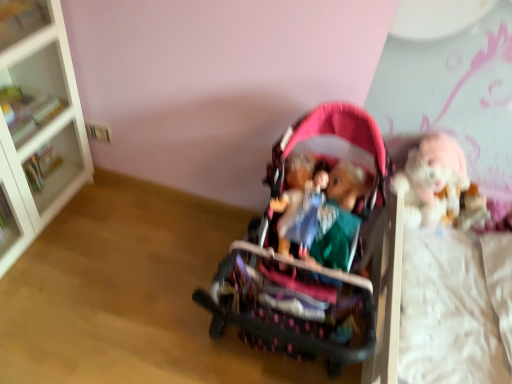
What do you see at coordinates (319, 246) in the screenshot? I see `pink fabric stroller at center` at bounding box center [319, 246].

What is the approximate height of matte plastic doll at center?

matte plastic doll at center is 6.48 inches in height.

Locate an element on the screen. The image size is (512, 384). white glossy cabinet at upper left is located at coordinates (41, 73).

From the image's perspective, is matte plastic doll at center located beneath pink fabric stroller at center?

No, from the image's perspective, matte plastic doll at center is not below pink fabric stroller at center.

How distant is matte plastic doll at center from pink fabric stroller at center?

matte plastic doll at center is 3.84 inches away from pink fabric stroller at center.

Considering the positions of objects matte plastic doll at center and pink fabric stroller at center in the image provided, who is more to the left, matte plastic doll at center or pink fabric stroller at center?

pink fabric stroller at center.

Is there a large distance between matte plastic doll at center and pink fabric stroller at center?

matte plastic doll at center is near pink fabric stroller at center, not far away.

Is white glass bookcase at left touching matte plastic doll at center?

No, white glass bookcase at left is not next to matte plastic doll at center.

From a real-world perspective, relative to matte plastic doll at center, is white glass bookcase at left vertically above or below?

From a real-world perspective, white glass bookcase at left is physically below matte plastic doll at center.

From the picture: From the image's perspective, which is below, white glass bookcase at left or matte plastic doll at center?

matte plastic doll at center appears lower in the image.

Is point (16, 38) in front of point (335, 247)?

No, it is not.

From the image's perspective, is fluffy white doll at right over white glossy cabinet at upper left?

No.

Is fluffy white doll at right facing towards white glossy cabinet at upper left?

No, fluffy white doll at right is not facing towards white glossy cabinet at upper left.

Is fluffy white doll at right thinner than white glossy cabinet at upper left?

Yes.

In the image, is fluffy white doll at right positioned in front of or behind white glossy cabinet at upper left?

fluffy white doll at right is positioned closer to the viewer than white glossy cabinet at upper left.

From a real-world perspective, is white glossy cabinet at upper left positioned under pink fabric stroller at center based on gravity?

No.

Locate an element on the screen. Image resolution: width=512 pixels, height=384 pixels. cabinet on the left side of pink fabric stroller at center is located at coordinates (41, 73).

Which of these two, white glossy cabinet at upper left or pink fabric stroller at center, is thinner?

white glossy cabinet at upper left is thinner.

Is pink fabric stroller at center at the back of white glossy cabinet at upper left?

No, white glossy cabinet at upper left's orientation is not away from pink fabric stroller at center.

Considering the relative sizes of white glass bookcase at left and white glossy cabinet at upper left in the image provided, is white glass bookcase at left thinner than white glossy cabinet at upper left?

Incorrect, the width of white glass bookcase at left is not less than that of white glossy cabinet at upper left.

Who is smaller, white glass bookcase at left or white glossy cabinet at upper left?

white glossy cabinet at upper left is smaller.

Is white glass bookcase at left oriented away from white glossy cabinet at upper left?

Yes, white glass bookcase at left is positioned with its back facing white glossy cabinet at upper left.

From the image's perspective, which one is positioned higher, white glass bookcase at left or white glossy cabinet at upper left?

white glossy cabinet at upper left is shown above in the image.

Between fluffy white doll at right and matte plastic doll at center, which one appears on the right side from the viewer's perspective?

fluffy white doll at right.

Which of these two, fluffy white doll at right or matte plastic doll at center, is wider?

Wider between the two is matte plastic doll at center.

Who is taller, fluffy white doll at right or matte plastic doll at center?

With more height is fluffy white doll at right.

Is matte plastic doll at center to the left or to the right of white glass bookcase at left in the image?

Based on their positions, matte plastic doll at center is located to the right of white glass bookcase at left.

Which is correct: matte plastic doll at center is inside white glass bookcase at left, or outside of it?

matte plastic doll at center is outside white glass bookcase at left.

Is matte plastic doll at center in front of white glass bookcase at left?

No, matte plastic doll at center is further to the viewer.

From a real-world perspective, is matte plastic doll at center above or below white glass bookcase at left?

From a real-world perspective, matte plastic doll at center is physically above white glass bookcase at left.

I want to click on toy located in front of the matte plastic doll at center, so click(319, 246).

Identify the location of person behind the white glass bookcase at left. The image size is (512, 384). (337, 215).

Estimate the real-world distances between objects in this image. Which object is closer to white glossy cabinet at upper left, matte plastic doll at center or fluffy white doll at right?

The object closer to white glossy cabinet at upper left is matte plastic doll at center.

Estimate the real-world distances between objects in this image. Which object is further from matte plastic doll at center, white glossy cabinet at upper left or pink fabric stroller at center?

white glossy cabinet at upper left is further to matte plastic doll at center.

Which object lies nearer to the anchor point matte plastic doll at center, white glass bookcase at left or white glossy cabinet at upper left?

Among the two, white glass bookcase at left is located nearer to matte plastic doll at center.

Which object lies nearer to the anchor point pink fabric stroller at center, fluffy white doll at right or white glossy cabinet at upper left?

fluffy white doll at right is positioned closer to the anchor pink fabric stroller at center.

Considering their positions, is white glass bookcase at left positioned further to white glossy cabinet at upper left than fluffy white doll at right?

The object further to white glossy cabinet at upper left is fluffy white doll at right.

Estimate the real-world distances between objects in this image. Which object is closer to pink fabric stroller at center, fluffy white doll at right or matte plastic doll at center?

matte plastic doll at center is closer to pink fabric stroller at center.

Looking at this image, which object lies further to the anchor point pink fabric stroller at center, fluffy white doll at right or white glass bookcase at left?

white glass bookcase at left lies further to pink fabric stroller at center than the other object.

Which object lies nearer to the anchor point white glass bookcase at left, fluffy white doll at right or pink fabric stroller at center?

Based on the image, pink fabric stroller at center appears to be nearer to white glass bookcase at left.

Identify the location of person between white glass bookcase at left and fluffy white doll at right. (337, 215).

At what (x,y) coordinates should I click in order to perform the action: click on toy between white glossy cabinet at upper left and matte plastic doll at center. Please return your answer as a coordinate pair (x, y). This screenshot has height=384, width=512. Looking at the image, I should click on (319, 246).

Locate an element on the screen. The image size is (512, 384). cabinet situated between white glass bookcase at left and matte plastic doll at center from left to right is located at coordinates (41, 73).

The image size is (512, 384). Identify the location of toy located between white glass bookcase at left and matte plastic doll at center in the left-right direction. (319, 246).